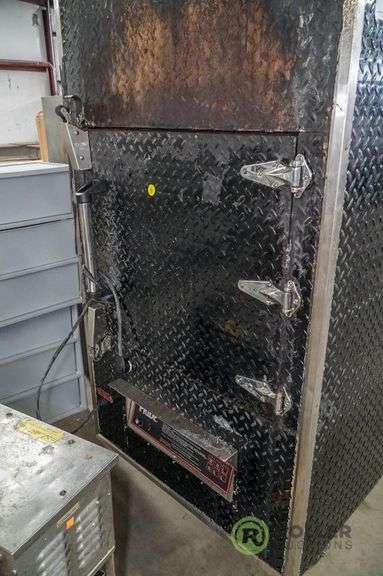
Where is `cord`? This screenshot has width=383, height=576. cord is located at coordinates (60, 342).